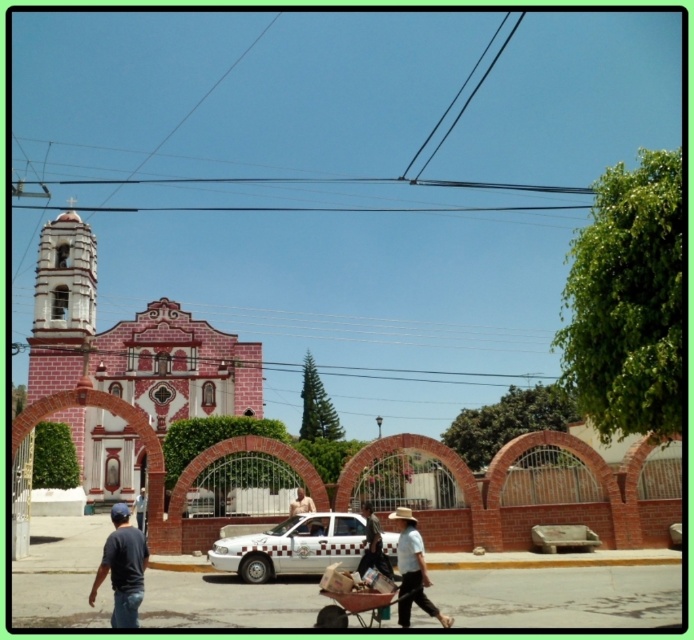
What do you see at coordinates (121, 566) in the screenshot? The width and height of the screenshot is (694, 640). I see `dark blue shirt at lower left` at bounding box center [121, 566].

The height and width of the screenshot is (640, 694). In order to click on dark blue shirt at lower left in this screenshot , I will do `click(121, 566)`.

Does point (133, 538) come behind point (289, 508)?

No, (133, 538) is closer to viewer.

Does dark blue shirt at lower left have a greater width compared to skinny man at center?

Yes.

At what (x,y) coordinates should I click in order to perform the action: click on dark blue shirt at lower left. Please return your answer as a coordinate pair (x, y). Looking at the image, I should click on (121, 566).

Identify the location of dark blue shirt at lower left. The height and width of the screenshot is (640, 694). (121, 566).

Who is shorter, red brick church at center or metallic silver cart at lower center?

Standing shorter between the two is metallic silver cart at lower center.

Is the position of red brick church at center less distant than that of metallic silver cart at lower center?

No, it is not.

Is point (208, 339) behind point (369, 582)?

Yes, it is behind point (369, 582).

I want to click on red brick church at center, so click(130, 340).